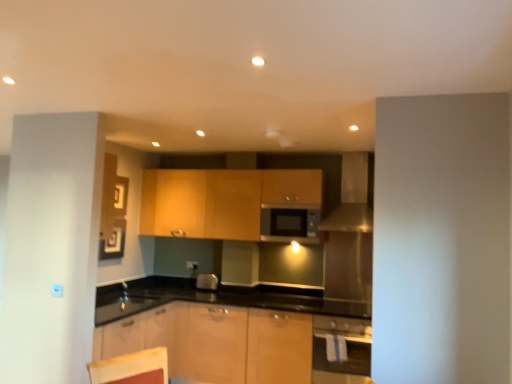
Question: Is white glossy oven at lower right closer to the viewer compared to satin silver exhaust hood at upper right?

Choices:
 (A) yes
 (B) no

Answer: (A)

Question: Considering the relative positions of white glossy oven at lower right and satin silver exhaust hood at upper right in the image provided, is white glossy oven at lower right to the right of satin silver exhaust hood at upper right from the viewer's perspective?

Choices:
 (A) yes
 (B) no

Answer: (B)

Question: Does white glossy oven at lower right have a greater width compared to satin silver exhaust hood at upper right?

Choices:
 (A) yes
 (B) no

Answer: (B)

Question: Is white glossy oven at lower right outside satin silver exhaust hood at upper right?

Choices:
 (A) yes
 (B) no

Answer: (A)

Question: From the image's perspective, is white glossy oven at lower right above satin silver exhaust hood at upper right?

Choices:
 (A) yes
 (B) no

Answer: (B)

Question: Could you tell me if white glossy oven at lower right is turned towards satin silver exhaust hood at upper right?

Choices:
 (A) no
 (B) yes

Answer: (A)

Question: Considering the relative sizes of matte silver microwave at center and matte wood cabinets at center in the image provided, is matte silver microwave at center wider than matte wood cabinets at center?

Choices:
 (A) yes
 (B) no

Answer: (B)

Question: Is matte silver microwave at center in front of matte wood cabinets at center?

Choices:
 (A) yes
 (B) no

Answer: (B)

Question: Can you confirm if matte silver microwave at center is taller than matte wood cabinets at center?

Choices:
 (A) no
 (B) yes

Answer: (A)

Question: Would you say matte wood cabinets at center is part of matte silver microwave at center's contents?

Choices:
 (A) no
 (B) yes

Answer: (A)

Question: Considering the relative sizes of matte silver microwave at center and matte wood cabinets at center in the image provided, is matte silver microwave at center shorter than matte wood cabinets at center?

Choices:
 (A) yes
 (B) no

Answer: (A)

Question: Is matte silver microwave at center touching matte wood cabinets at center?

Choices:
 (A) yes
 (B) no

Answer: (B)

Question: Does white glossy oven at lower right appear on the left side of matte silver microwave at center?

Choices:
 (A) no
 (B) yes

Answer: (A)